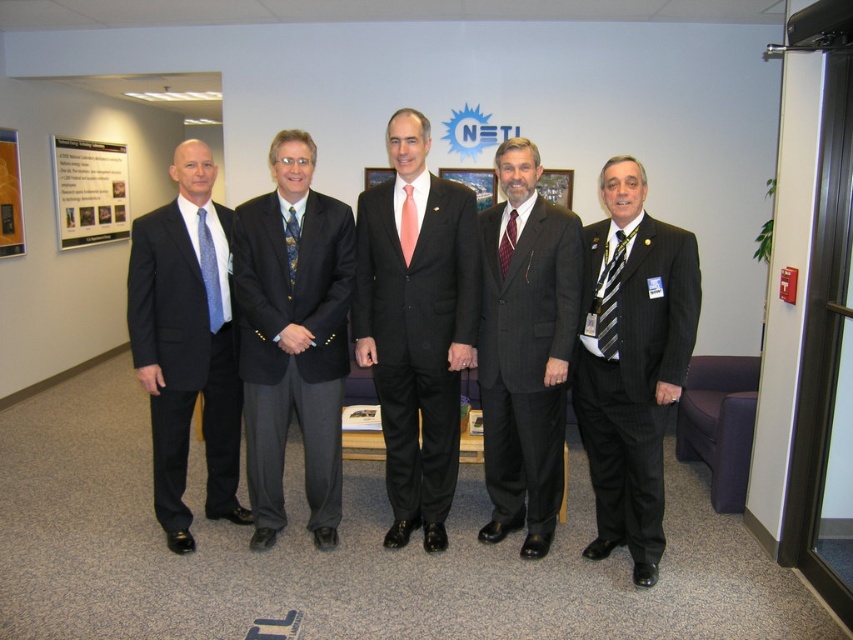
You are organizing a photo shoot for a corporate event and need to arrange the men in order based on their tie colors. The scene shows two men with pink satin tie at center and maroon satin tie at center. From left to right, which color comes first?

The pink satin tie at center is to the left of the maroon satin tie at center, so from left to right, the pink satin tie at center comes first.

You are a photographer standing 10 feet away from the camera position. You need to adjust your position to focus on the pink satin tie at center. Can you reach the tie by moving forward without stepping into the frame?

The pink satin tie at center is 9.32 feet from the camera. Since you are already 10 feet away from the camera position, moving forward 0.68 feet would bring you close enough to adjust your focus without entering the frame.

You are a photographer setting up for a group photo in an office. You notice a matte black suit at center marked by point (x=416, y=326). Where should you position your camera to ensure the matte black suit at center is centered in the frame?

Position the camera so that the center of the frame aligns with the point (x=416, y=326) where the matte black suit at center is located.